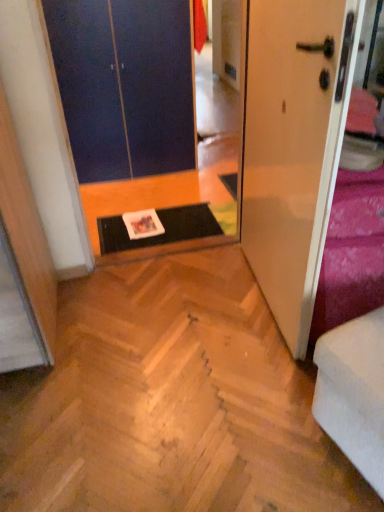
I want to click on blank space situated above black rubber doormat at center (from a real-world perspective), so click(x=162, y=223).